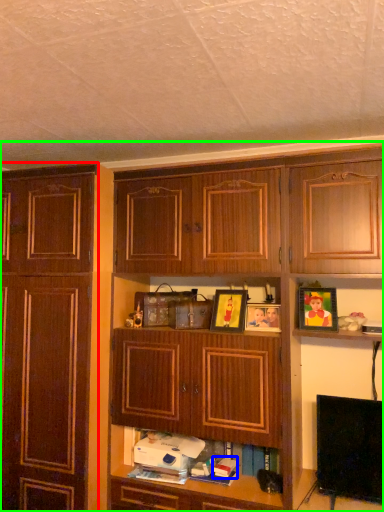
Question: Which object is positioned closest to cabinetry (highlighted by a red box)? Select from book (highlighted by a blue box) and cabinetry (highlighted by a green box).

Choices:
 (A) book
 (B) cabinetry

Answer: (B)